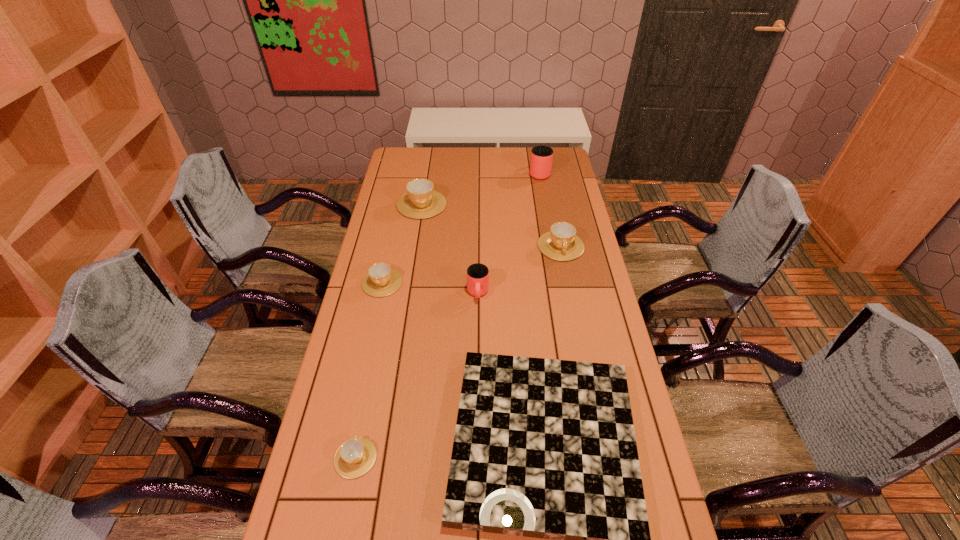
Locate an element on the screen. This screenshot has height=540, width=960. the nearest brown cup is located at coordinates (355, 457).

Locate an element on the screen. This screenshot has height=540, width=960. the nearest cup is located at coordinates (355, 457).

What are the coordinates of `vacant area situated on the handle side of the farther pink cup` in the screenshot? It's located at (536, 150).

Find the location of a particular element. free space located 0.050m on the handle side of the farther pink cup is located at coordinates (537, 159).

Identify the location of blank space located on the handle side of the farther pink cup. The image size is (960, 540). tap(537, 158).

Locate an element on the screen. This screenshot has height=540, width=960. vacant area situated 0.300m with the handle on the side of the second farthest object is located at coordinates (429, 157).

Where is `vacant space positioned 0.080m with the handle on the side of the second farthest object`? This screenshot has height=540, width=960. vacant space positioned 0.080m with the handle on the side of the second farthest object is located at coordinates (425, 181).

Where is `vacant position located 0.050m with the handle on the side of the second farthest object`? vacant position located 0.050m with the handle on the side of the second farthest object is located at coordinates (425, 185).

Identify the location of vacant space positioned 0.360m on the handle side of the third cup from right to left. (477, 400).

At what (x,y) coordinates should I click in order to perform the action: click on free space located with the handle on the side of the rightmost brown cup. Please return your answer as a coordinate pair (x, y). This screenshot has width=960, height=540. Looking at the image, I should click on (577, 329).